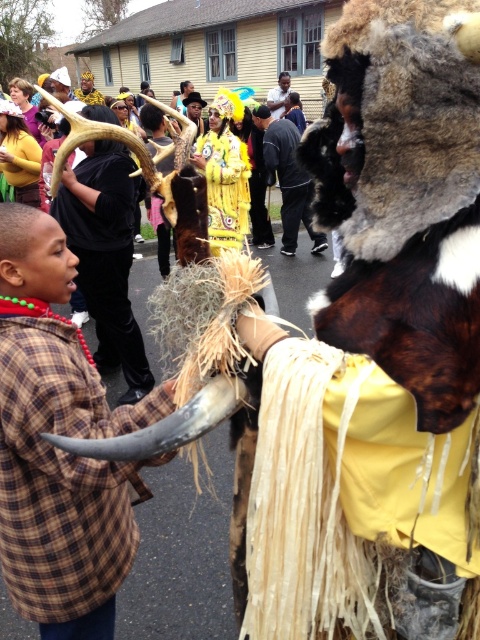
Does point (262, 122) come closer to viewer compared to point (283, 84)?

Yes, point (262, 122) is closer to viewer.

Between black leather jacket at center and smooth skin man at center, which one is positioned lower?

black leather jacket at center is below.

You are a GUI agent. You are given a task and a screenshot of the screen. Output one action in this format:
    pyautogui.click(x=<x>, y=<y>)
    Task: Click on the black leather jacket at center
    The height and width of the screenshot is (640, 480).
    Given the screenshot: What is the action you would take?
    pyautogui.click(x=288, y=179)

Is point (216, 221) closer to viewer compared to point (291, 150)?

Yes.

Does yellow fuzzy costume at center have a larger size compared to black leather jacket at center?

No.

Is point (230, 196) farther from camera compared to point (287, 180)?

No, it is in front of (287, 180).

I want to click on yellow fuzzy costume at center, so click(225, 186).

Is point (8, 314) closer to camera compared to point (239, 141)?

Yes, point (8, 314) is closer to viewer.

Who is lower down, brown woven grass at left or yellow fuzzy costume at center?

brown woven grass at left is lower down.

Does point (28, 416) come closer to viewer compared to point (207, 166)?

Yes, it is.

Find the location of a particular element. brown woven grass at left is located at coordinates (61, 474).